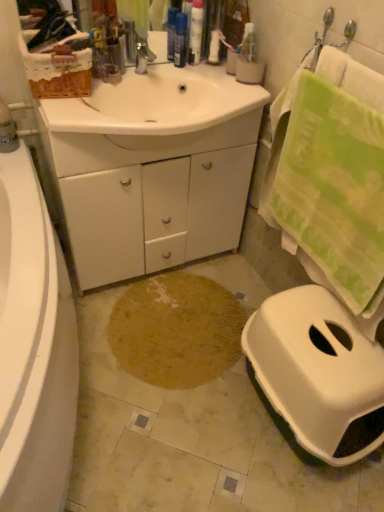
Where is `free space to the left of white plastic toilet at lower right`? This screenshot has height=512, width=384. free space to the left of white plastic toilet at lower right is located at coordinates pos(183,433).